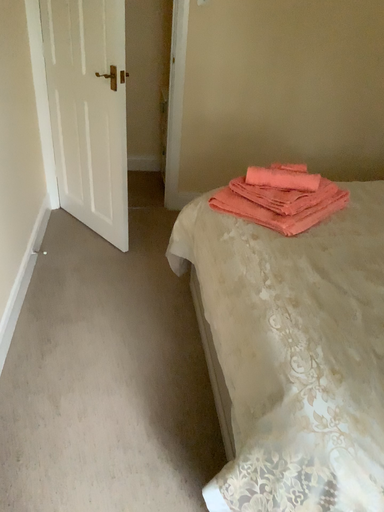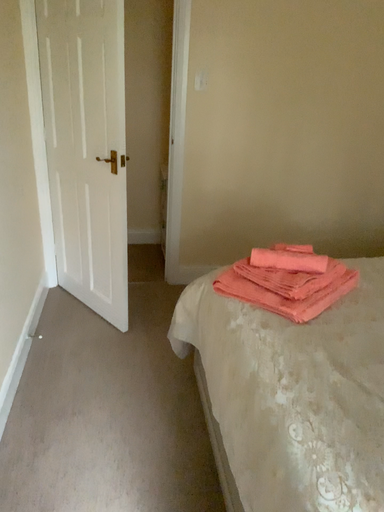
Question: How did the camera likely rotate when shooting the video?

Choices:
 (A) rotated downward
 (B) rotated upward

Answer: (B)